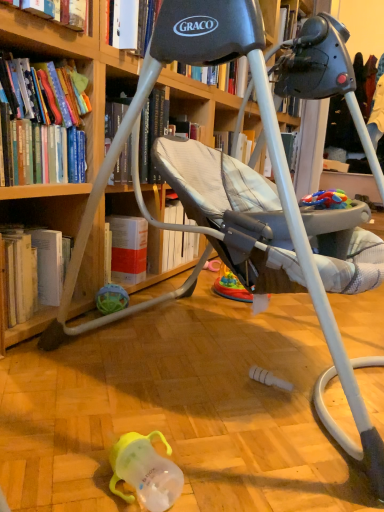
Question: Is rubberized plastic toy at right, which appears as the first toy when viewed from the right, positioned in front of hardcover book at lower left, the first book when ordered from bottom to top?

Choices:
 (A) yes
 (B) no

Answer: (A)

Question: Is rubberized plastic toy at right, which ranks as the second toy in left-to-right order, with hardcover book at lower left, the first book when ordered from bottom to top?

Choices:
 (A) no
 (B) yes

Answer: (A)

Question: Can you confirm if rubberized plastic toy at right, which appears as the first toy when viewed from the right, is thinner than hardcover book at lower left, the first book when ordered from bottom to top?

Choices:
 (A) yes
 (B) no

Answer: (A)

Question: Is rubberized plastic toy at right, the second toy in the back-to-front sequence, facing away from hardcover book at lower left, the first book when ordered from bottom to top?

Choices:
 (A) yes
 (B) no

Answer: (B)

Question: From the image's perspective, is rubberized plastic toy at right, which ranks as the second toy in left-to-right order, over hardcover book at lower left, which is the 3th book from top to bottom?

Choices:
 (A) yes
 (B) no

Answer: (A)

Question: Is rubberized plastic toy at right, which ranks as the second toy in left-to-right order, inside the boundaries of wooden bookcase at upper left, or outside?

Choices:
 (A) inside
 (B) outside

Answer: (A)

Question: Based on their sizes in the image, would you say rubberized plastic toy at right, which is the 2th toy in bottom-to-top order, is bigger or smaller than wooden bookcase at upper left?

Choices:
 (A) big
 (B) small

Answer: (B)

Question: From a real-world perspective, is rubberized plastic toy at right, which appears as the first toy when viewed from the right, positioned above or below wooden bookcase at upper left?

Choices:
 (A) above
 (B) below

Answer: (B)

Question: Considering their positions, is rubberized plastic toy at right, the second toy in the back-to-front sequence, located in front of or behind wooden bookcase at upper left?

Choices:
 (A) behind
 (B) front

Answer: (A)

Question: Choose the correct answer: Is translucent rubber ball at lower left, which is the 2th toy in right-to-left order, inside wooden bookcase at upper left or outside it?

Choices:
 (A) inside
 (B) outside

Answer: (A)

Question: Considering the positions of translucent rubber ball at lower left, which appears as the first toy when viewed from the left, and wooden bookcase at upper left in the image, is translucent rubber ball at lower left, which appears as the first toy when viewed from the left, wider or thinner than wooden bookcase at upper left?

Choices:
 (A) thin
 (B) wide

Answer: (A)

Question: Is translucent rubber ball at lower left, which is the second toy from front to back, to the left or to the right of wooden bookcase at upper left in the image?

Choices:
 (A) right
 (B) left

Answer: (B)

Question: Relative to wooden bookcase at upper left, is translucent rubber ball at lower left, which is the 2th toy in right-to-left order, in front or behind?

Choices:
 (A) behind
 (B) front

Answer: (A)

Question: Is hardcover book at upper left, which appears as the first book when viewed from the top, to the left or to the right of hardcover book at upper left, marked as the 2th book in a bottom-to-top arrangement, in the image?

Choices:
 (A) left
 (B) right

Answer: (B)

Question: In terms of size, does hardcover book at upper left, which appears as the first book when viewed from the top, appear bigger or smaller than hardcover book at upper left, marked as the 2th book in a bottom-to-top arrangement?

Choices:
 (A) small
 (B) big

Answer: (A)